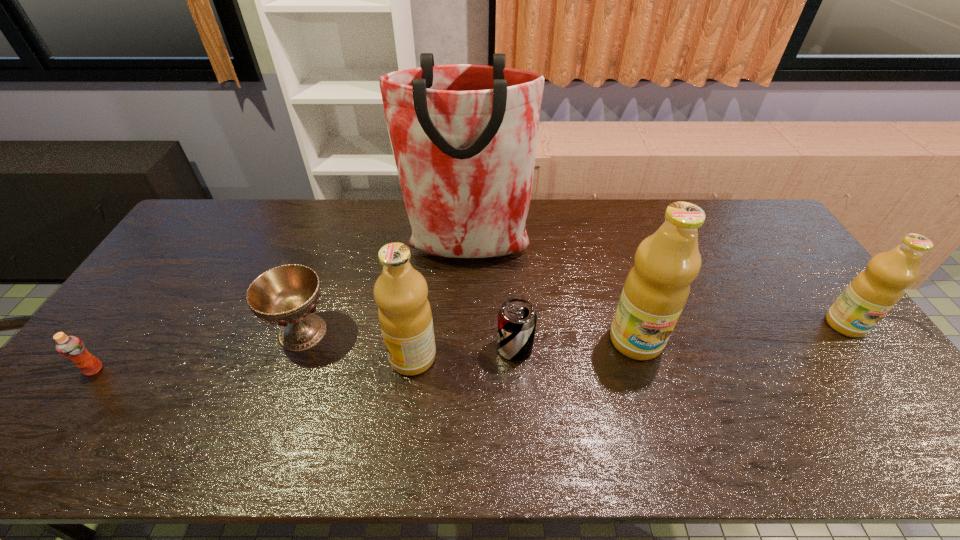
Find the location of a particular element. This screenshot has height=540, width=960. object that is at the left edge is located at coordinates (71, 347).

The width and height of the screenshot is (960, 540). I want to click on object at the right edge, so click(x=876, y=290).

Locate an element on the screen. The height and width of the screenshot is (540, 960). vacant space at the far edge of the desktop is located at coordinates (255, 202).

In the image, there is a desktop. Identify the location of blank space at the near edge. (756, 405).

The width and height of the screenshot is (960, 540). What are the coordinates of `free spot at the left edge of the desktop` in the screenshot? It's located at (145, 307).

Find the location of a particular element. The image size is (960, 540). vacant space at the right edge is located at coordinates (776, 262).

In the image, there is a desktop. In order to click on vacant space at the far right corner in this screenshot , I will do `click(737, 210)`.

In order to click on vacant space at the near right corner of the desktop in this screenshot , I will do `click(855, 415)`.

What are the coordinates of `vacant area that lies between the second olive oil from right to left and the tallest object` in the screenshot? It's located at (551, 296).

Where is `unoccupied area between the chalice and the fifth shortest object`? unoccupied area between the chalice and the fifth shortest object is located at coordinates (358, 345).